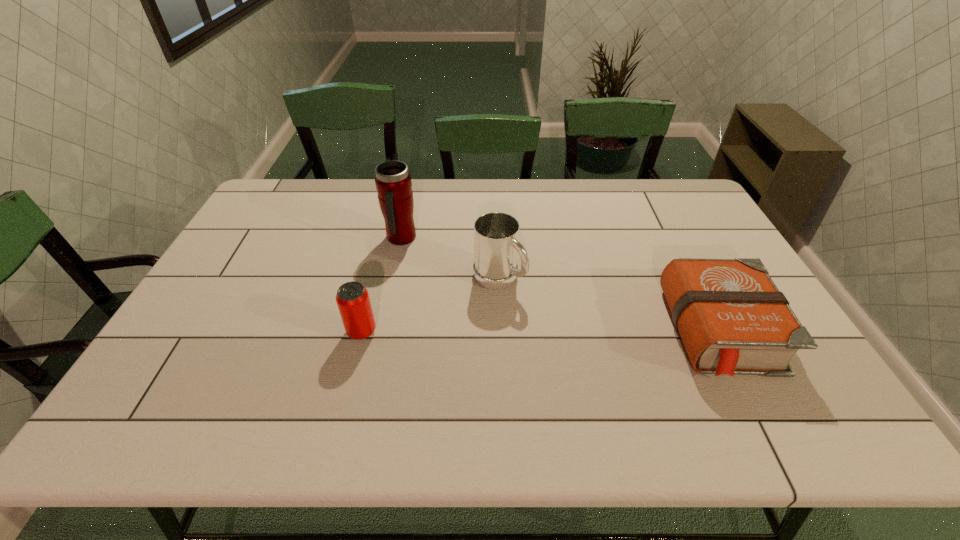
The width and height of the screenshot is (960, 540). Find the location of `can`. can is located at coordinates (352, 298).

The width and height of the screenshot is (960, 540). I want to click on Bible, so click(732, 319).

Where is `the rightmost object`? This screenshot has width=960, height=540. the rightmost object is located at coordinates click(x=732, y=319).

The height and width of the screenshot is (540, 960). In order to click on thermos bottle in this screenshot , I will do `click(393, 182)`.

This screenshot has width=960, height=540. Find the location of `the tallest object`. the tallest object is located at coordinates (393, 182).

The image size is (960, 540). I want to click on the second object from right to left, so click(496, 235).

At what (x,y) coordinates should I click in order to perform the action: click on the second tallest object. Please return your answer as a coordinate pair (x, y). Looking at the image, I should click on (496, 235).

You are a GUI agent. You are given a task and a screenshot of the screen. Output one action in this format:
    pyautogui.click(x=<x>, y=<y>)
    Task: Click on the vacant space positioned on the back of the can
    Image resolution: width=960 pixels, height=540 pixels.
    Given the screenshot: What is the action you would take?
    pyautogui.click(x=378, y=267)

In order to click on blank space located 0.360m on the back of the rightmost object in this screenshot , I will do `click(665, 216)`.

The width and height of the screenshot is (960, 540). I want to click on vacant space positioned 0.070m on the side with the handle of the thermos bottle, so click(420, 262).